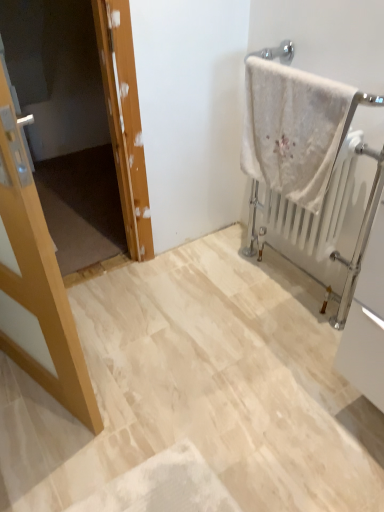
The width and height of the screenshot is (384, 512). Identify the location of vacant location below wooden door at left (from a real-world perspective). (97, 272).